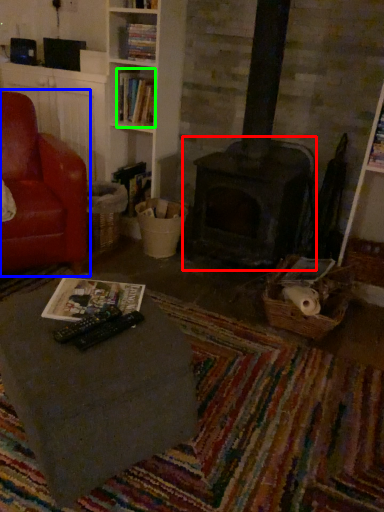
Question: Estimate the real-world distances between objects in this image. Which object is farther from fireplace (highlighted by a red box), chair (highlighted by a blue box) or book (highlighted by a green box)?

Choices:
 (A) chair
 (B) book

Answer: (A)